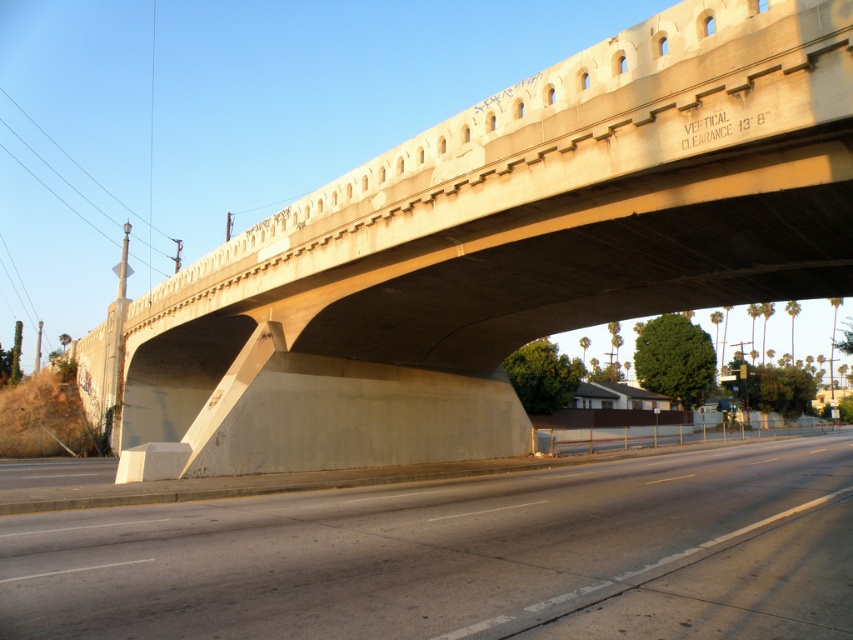
Question: Among these points, which one is farthest from the camera?

Choices:
 (A) (688, 611)
 (B) (708, 61)

Answer: (B)

Question: Is concrete bridge at center to the right of gray concrete highway at lower center from the viewer's perspective?

Choices:
 (A) no
 (B) yes

Answer: (A)

Question: Can you confirm if concrete bridge at center is positioned to the left of gray concrete highway at lower center?

Choices:
 (A) yes
 (B) no

Answer: (A)

Question: Which point appears farthest from the camera in this image?

Choices:
 (A) (846, 115)
 (B) (764, 561)

Answer: (B)

Question: Is concrete bridge at center to the right of gray concrete highway at lower center from the viewer's perspective?

Choices:
 (A) no
 (B) yes

Answer: (A)